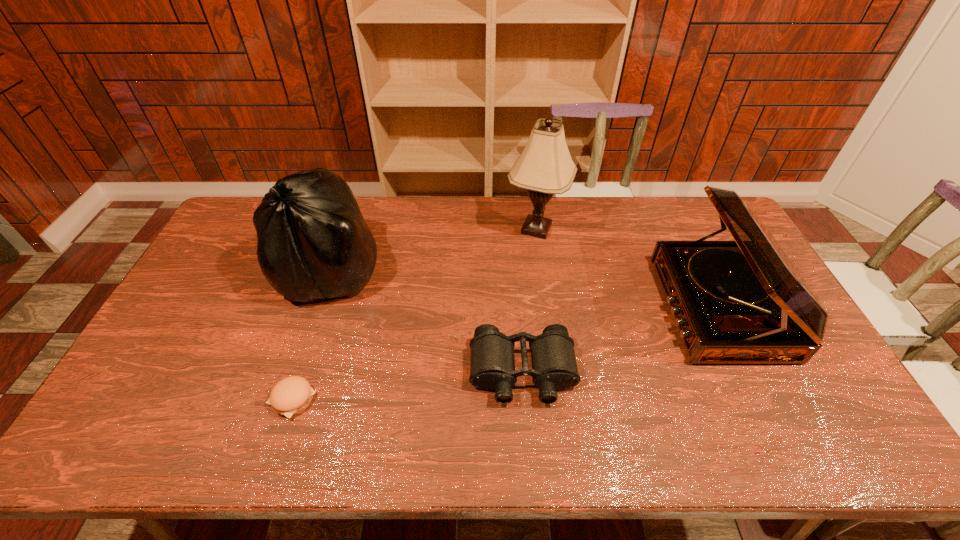
In the image, there is a desktop. Where is `vacant area at the right edge`? The height and width of the screenshot is (540, 960). vacant area at the right edge is located at coordinates (798, 421).

I want to click on free space at the far left corner of the desktop, so (251, 204).

In the image, there is a desktop. Identify the location of vacant space at the near left corner. The height and width of the screenshot is (540, 960). (168, 428).

Find the location of a particular element. Image resolution: width=960 pixels, height=540 pixels. vacant space at the near right corner is located at coordinates (859, 453).

Identify the location of vacant space that's between the lamp and the record player. This screenshot has width=960, height=540. (628, 268).

Where is `free spot between the third shortest object and the second shortest object`? This screenshot has height=540, width=960. free spot between the third shortest object and the second shortest object is located at coordinates (621, 340).

Image resolution: width=960 pixels, height=540 pixels. In order to click on empty space between the plastic bag and the patty in this screenshot , I will do `click(312, 334)`.

This screenshot has width=960, height=540. Identify the location of vacant space that is in between the second shortest object and the shortest object. (408, 386).

Find the location of a particular element. The width and height of the screenshot is (960, 540). free point between the second shortest object and the plastic bag is located at coordinates (427, 320).

Find the location of `free area in between the plastic bag and the binoculars`. free area in between the plastic bag and the binoculars is located at coordinates (427, 320).